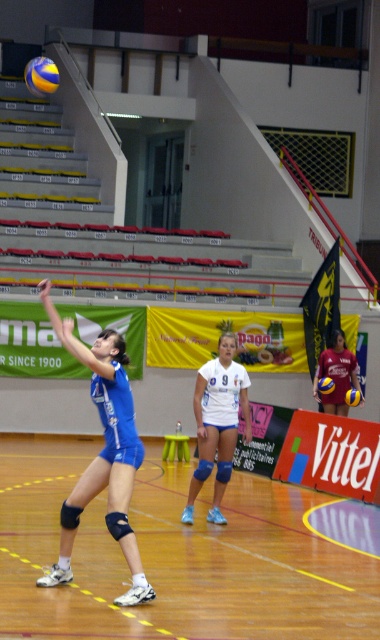
Is wooden floor at center bigger than yellow matte volleyball at upper left?

No.

Based on the photo, is wooden floor at center positioned before yellow matte volleyball at upper left?

Yes, wooden floor at center is closer to the viewer.

Who is more distant from viewer, (253, 540) or (33, 93)?

The point (33, 93) is behind.

Where is `wooden floor at center`? wooden floor at center is located at coordinates (174, 557).

Can you confirm if yellow matte volleyball at upper left is smaller than yellow matte volleyball at center?

No, yellow matte volleyball at upper left is not smaller than yellow matte volleyball at center.

Measure the distance between yellow matte volleyball at upper left and camera.

15.18 meters

Which is in front, point (26, 76) or point (332, 388)?

Point (26, 76)

Find the location of `yellow matte volleyball at upper left`. yellow matte volleyball at upper left is located at coordinates (41, 76).

Does white jersey at center have a greater width compared to yellow and blue textured volleyball at center?

Yes.

Does white jersey at center appear under yellow and blue textured volleyball at center?

Actually, white jersey at center is above yellow and blue textured volleyball at center.

The height and width of the screenshot is (640, 380). Identify the location of white jersey at center. (335, 374).